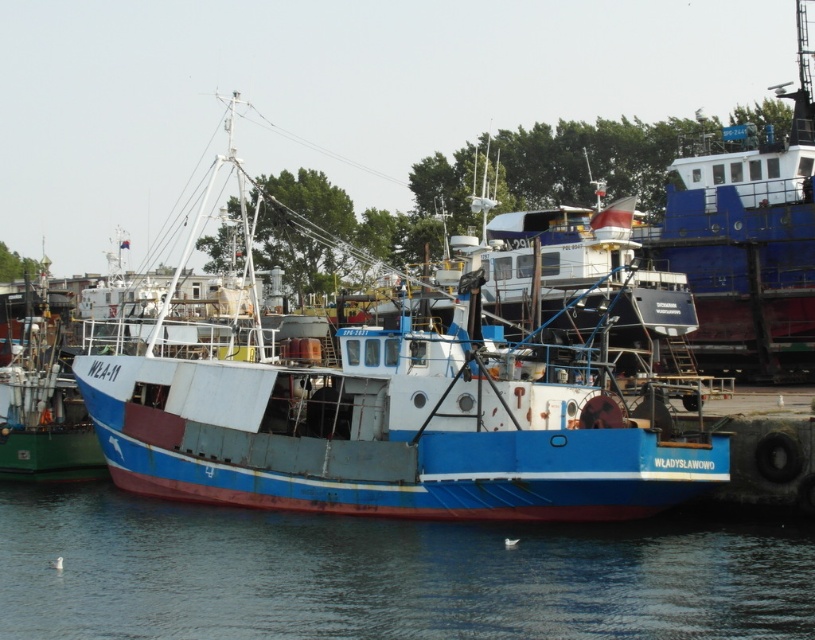
Which is behind, point (637, 472) or point (95, 515)?

Point (95, 515)

Does blue painted metal boat at center have a smaller size compared to blue water at lower center?

Actually, blue painted metal boat at center might be larger than blue water at lower center.

Which is behind, point (201, 432) or point (250, 616)?

The point (201, 432) is more distant.

At what (x,y) coordinates should I click in order to perform the action: click on blue painted metal boat at center. Please return your answer as a coordinate pair (x, y). The height and width of the screenshot is (640, 815). Looking at the image, I should click on (386, 413).